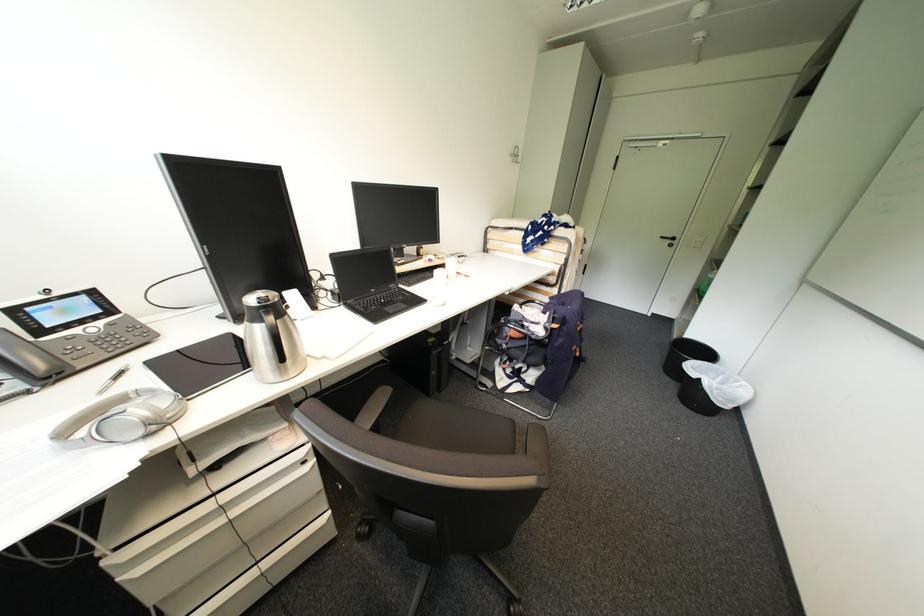
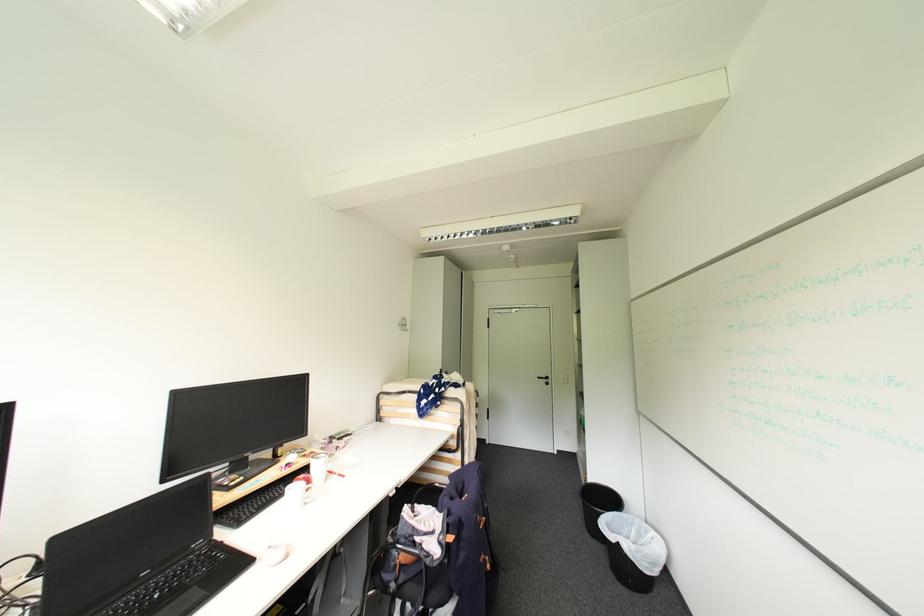
Where in the second image is the point corresponding to (434,302) from the first image?

(263, 562)